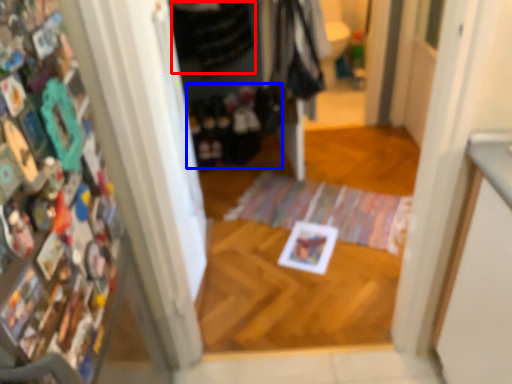
Question: Which of the following is the closest to the observer, clothing (highlighted by a red box) or clothing (highlighted by a blue box)?

Choices:
 (A) clothing
 (B) clothing

Answer: (A)